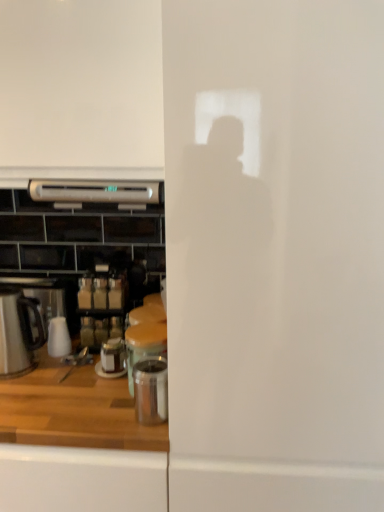
Question: Is stainless steel kettle at left, placed as the 2th kitchen appliance when sorted from right to left, located outside polished stainless steel container at lower center, which is the 1th appliance from front to back?

Choices:
 (A) no
 (B) yes

Answer: (B)

Question: From a real-world perspective, is stainless steel kettle at left, which is the 1th kitchen appliance in left-to-right order, below polished stainless steel container at lower center, which ranks as the 3th appliance in back-to-front order?

Choices:
 (A) yes
 (B) no

Answer: (B)

Question: Can you confirm if stainless steel kettle at left, placed as the 2th kitchen appliance when sorted from right to left, is shorter than polished stainless steel container at lower center, which is the 1th appliance from front to back?

Choices:
 (A) no
 (B) yes

Answer: (A)

Question: Is stainless steel kettle at left, which is the 1th kitchen appliance in left-to-right order, thinner than polished stainless steel container at lower center, which is the 1th appliance from front to back?

Choices:
 (A) yes
 (B) no

Answer: (B)

Question: From the image's perspective, does stainless steel kettle at left, which is the 1th kitchen appliance in left-to-right order, appear lower than polished stainless steel container at lower center, which ranks as the 3th appliance in back-to-front order?

Choices:
 (A) yes
 (B) no

Answer: (B)

Question: Choose the correct answer: Is polished stainless steel container at lower center, which ranks as the 3th appliance in back-to-front order, inside satin silver microwave at upper center, the second kitchen appliance in the left-to-right sequence, or outside it?

Choices:
 (A) outside
 (B) inside

Answer: (A)

Question: Based on their positions, is polished stainless steel container at lower center, which ranks as the 3th appliance in back-to-front order, located to the left or right of satin silver microwave at upper center, the first kitchen appliance when ordered from right to left?

Choices:
 (A) right
 (B) left

Answer: (A)

Question: Considering their positions, is polished stainless steel container at lower center, which ranks as the 3th appliance in back-to-front order, located in front of or behind satin silver microwave at upper center, the first kitchen appliance when ordered from right to left?

Choices:
 (A) front
 (B) behind

Answer: (A)

Question: From their relative heights in the image, would you say polished stainless steel container at lower center, which ranks as the 3th appliance in back-to-front order, is taller or shorter than satin silver microwave at upper center, the first kitchen appliance when ordered from right to left?

Choices:
 (A) short
 (B) tall

Answer: (B)

Question: Is white glossy microwave at upper left inside the boundaries of stainless steel kettle at left, marked as the 2th kitchen appliance in a top-to-bottom arrangement, or outside?

Choices:
 (A) inside
 (B) outside

Answer: (B)

Question: From a real-world perspective, is white glossy microwave at upper left positioned above or below stainless steel kettle at left, marked as the 2th kitchen appliance in a top-to-bottom arrangement?

Choices:
 (A) below
 (B) above

Answer: (B)

Question: From the image's perspective, is white glossy microwave at upper left positioned above or below stainless steel kettle at left, marked as the 2th kitchen appliance in a top-to-bottom arrangement?

Choices:
 (A) above
 (B) below

Answer: (A)

Question: Is white glossy microwave at upper left bigger or smaller than stainless steel kettle at left, placed as the 2th kitchen appliance when sorted from right to left?

Choices:
 (A) small
 (B) big

Answer: (B)

Question: From a real-world perspective, is polished stainless steel container at lower center, which ranks as the 3th appliance in back-to-front order, physically located above or below metallic glass jar at center, positioned as the 3th appliance in front-to-back order?

Choices:
 (A) above
 (B) below

Answer: (A)

Question: Relative to metallic glass jar at center, which is counted as the first appliance, starting from the back, is polished stainless steel container at lower center, which ranks as the 3th appliance in back-to-front order, in front or behind?

Choices:
 (A) behind
 (B) front

Answer: (B)